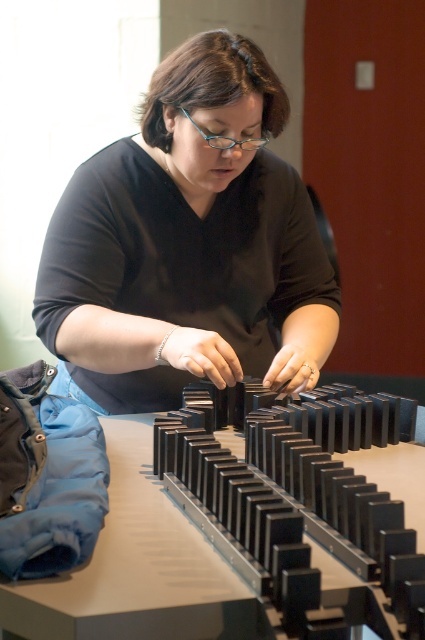
Question: In this image, where is matte black shirt at center located relative to black plastic blocks at center?

Choices:
 (A) below
 (B) above

Answer: (B)

Question: Which of the following is the farthest from the observer?

Choices:
 (A) matte black shirt at center
 (B) black plastic blocks at center

Answer: (A)

Question: Is matte black shirt at center in front of black plastic blocks at center?

Choices:
 (A) no
 (B) yes

Answer: (A)

Question: Does matte black shirt at center have a larger size compared to black plastic blocks at center?

Choices:
 (A) yes
 (B) no

Answer: (A)